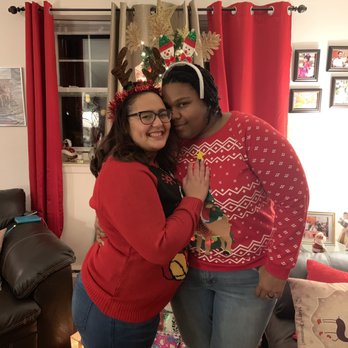
You are a GUI agent. You are given a task and a screenshot of the screen. Output one action in this format:
    pyautogui.click(x=<x>, y=<y>)
    Task: Click on the right side of couch
    This screenshot has height=348, width=348.
    Given the screenshot: What is the action you would take?
    pyautogui.click(x=42, y=276)